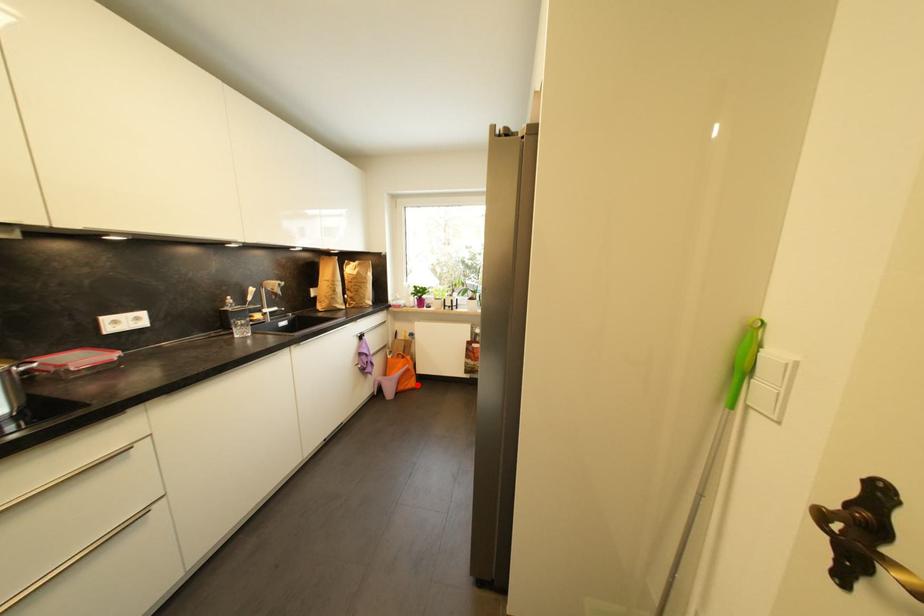
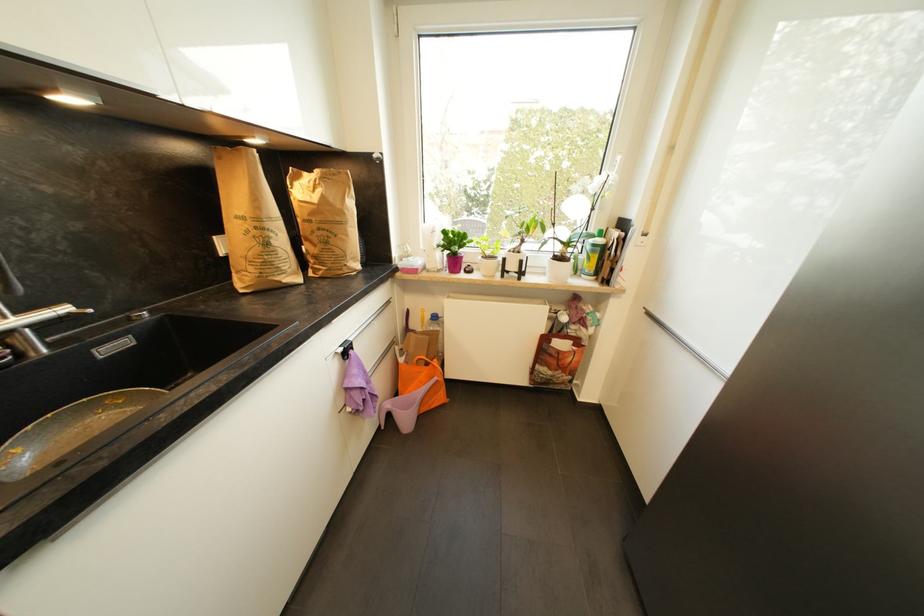
Question: I am providing you with two images of the same scene from different viewpoints. A red point is marked on the first image. At the location where the point appears in image 1, is it still visible in image 2?

Choices:
 (A) Yes
 (B) No

Answer: (A)